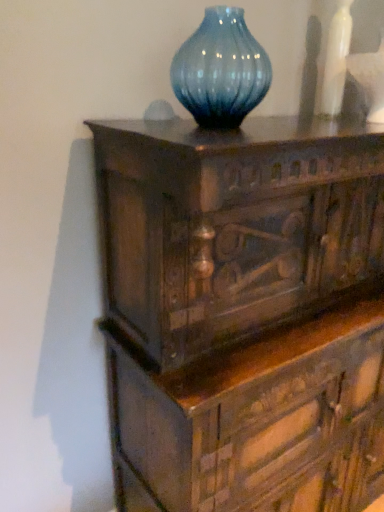
Question: Should I look upward or downward to see dark wood chest of drawers at center?

Choices:
 (A) down
 (B) up

Answer: (A)

Question: Is white glossy vase at upper right behind dark wood chest of drawers at center?

Choices:
 (A) no
 (B) yes

Answer: (B)

Question: From a real-world perspective, does white glossy vase at upper right sit lower than dark wood chest of drawers at center?

Choices:
 (A) yes
 (B) no

Answer: (B)

Question: Are white glossy vase at upper right and dark wood chest of drawers at center making contact?

Choices:
 (A) yes
 (B) no

Answer: (B)

Question: Would you say white glossy vase at upper right contains dark wood chest of drawers at center?

Choices:
 (A) no
 (B) yes

Answer: (A)

Question: Is white glossy vase at upper right wider than dark wood chest of drawers at center?

Choices:
 (A) no
 (B) yes

Answer: (A)

Question: Considering the relative positions of white glossy vase at upper right and dark wood chest of drawers at center in the image provided, is white glossy vase at upper right to the right of dark wood chest of drawers at center from the viewer's perspective?

Choices:
 (A) no
 (B) yes

Answer: (A)

Question: Considering the relative positions of dark wood chest of drawers at center and white glossy vase at upper right in the image provided, is dark wood chest of drawers at center to the left of white glossy vase at upper right from the viewer's perspective?

Choices:
 (A) yes
 (B) no

Answer: (B)

Question: Does dark wood chest of drawers at center have a lesser width compared to white glossy vase at upper right?

Choices:
 (A) yes
 (B) no

Answer: (B)

Question: Does dark wood chest of drawers at center have a greater height compared to white glossy vase at upper right?

Choices:
 (A) yes
 (B) no

Answer: (A)

Question: Does dark wood chest of drawers at center have a greater width compared to white glossy vase at upper right?

Choices:
 (A) no
 (B) yes

Answer: (B)

Question: Are dark wood chest of drawers at center and white glossy vase at upper right far apart?

Choices:
 (A) no
 (B) yes

Answer: (A)

Question: From the image's perspective, would you say dark wood chest of drawers at center is positioned over white glossy vase at upper right?

Choices:
 (A) yes
 (B) no

Answer: (B)

Question: Looking at their shapes, would you say dark wood chest of drawers at center is wider or thinner than white glossy vase at upper right?

Choices:
 (A) thin
 (B) wide

Answer: (B)